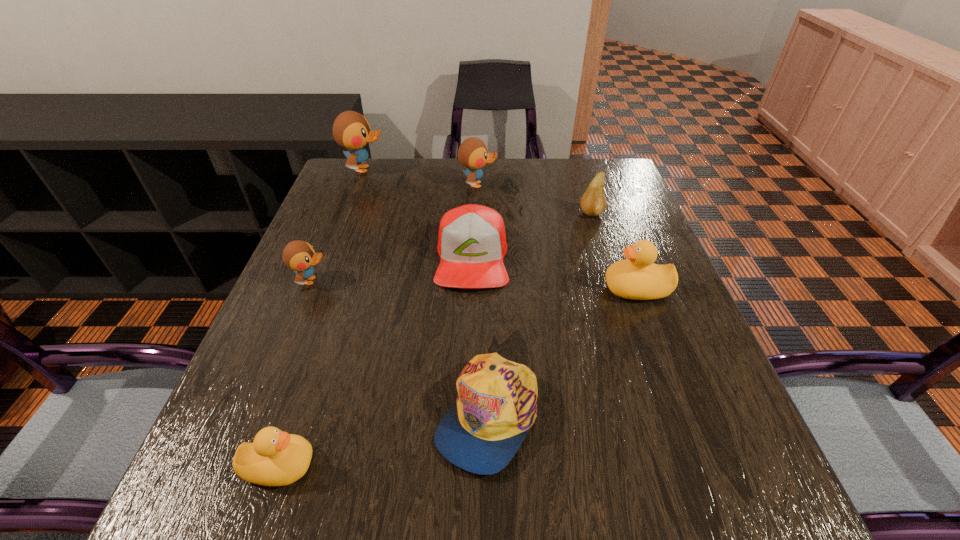
You are a GUI agent. You are given a task and a screenshot of the screen. Output one action in this format:
    pyautogui.click(x=<x>, y=<y>)
    Task: Click on the blank space that satisfies the following two spatial constraints: 1. on the face of the bigger yellow duck; 2. on the bill of the cap
    The image size is (960, 540).
    Given the screenshot: What is the action you would take?
    pyautogui.click(x=683, y=414)

Where is `free space in the image that satisfies the following two spatial constraints: 1. on the front-facing side of the biggest blue duck; 2. on the right side of the pear`? The width and height of the screenshot is (960, 540). free space in the image that satisfies the following two spatial constraints: 1. on the front-facing side of the biggest blue duck; 2. on the right side of the pear is located at coordinates (348, 214).

Locate an element on the screen. blank area in the image that satisfies the following two spatial constraints: 1. on the front-facing side of the red baseball cap; 2. on the face of the nearer yellow duck is located at coordinates (468, 466).

The width and height of the screenshot is (960, 540). Identify the location of free point that satisfies the following two spatial constraints: 1. on the front-facing side of the pear; 2. on the right side of the tallest duck. (348, 214).